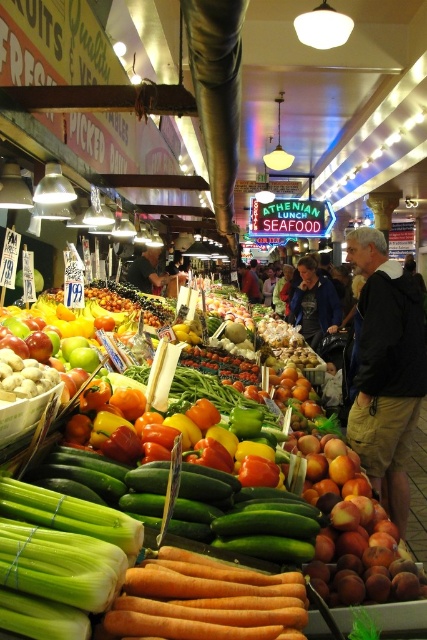
Question: Can you confirm if blue cotton jacket at center is bigger than dark blue jacket at center?

Choices:
 (A) yes
 (B) no

Answer: (B)

Question: Is black cotton jacket at center wider than dark blue jacket at center?

Choices:
 (A) no
 (B) yes

Answer: (A)

Question: Which object appears closest to the camera in this image?

Choices:
 (A) dark blue jacket at center
 (B) black cotton jacket at center

Answer: (B)

Question: Which of the following is the closest to the observer?

Choices:
 (A) dark blue jacket at center
 (B) black cotton jacket at center

Answer: (B)

Question: Is black cotton jacket at center closer to the viewer compared to dark blue jacket at center?

Choices:
 (A) yes
 (B) no

Answer: (A)

Question: Which of the following is the farthest from the observer?

Choices:
 (A) (333, 284)
 (B) (132, 627)

Answer: (A)